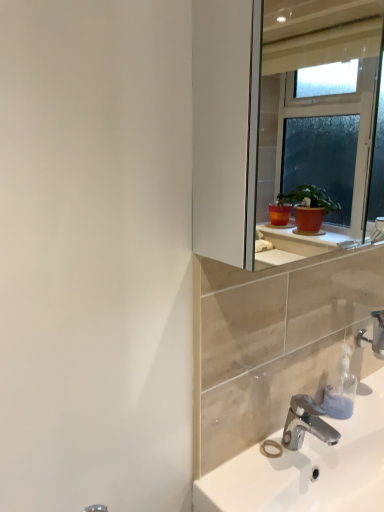
Question: Can you confirm if white glossy sink at lower right is positioned to the left of silver metallic faucet at lower right, which is the 1th tap in right-to-left order?

Choices:
 (A) no
 (B) yes

Answer: (B)

Question: Is white glossy sink at lower right shorter than silver metallic faucet at lower right, the 1th tap viewed from the top?

Choices:
 (A) yes
 (B) no

Answer: (A)

Question: Is white glossy sink at lower right further to camera compared to silver metallic faucet at lower right, placed as the second tap when sorted from bottom to top?

Choices:
 (A) yes
 (B) no

Answer: (B)

Question: Considering the relative sizes of white glossy sink at lower right and silver metallic faucet at lower right, the second tap in the left-to-right sequence, in the image provided, is white glossy sink at lower right wider than silver metallic faucet at lower right, the second tap in the left-to-right sequence,?

Choices:
 (A) yes
 (B) no

Answer: (A)

Question: Considering the relative positions of white glossy sink at lower right and silver metallic faucet at lower right, the 1th tap viewed from the top, in the image provided, is white glossy sink at lower right to the right of silver metallic faucet at lower right, the 1th tap viewed from the top, from the viewer's perspective?

Choices:
 (A) yes
 (B) no

Answer: (B)

Question: Is point (350, 373) positioned closer to the camera than point (299, 435)?

Choices:
 (A) closer
 (B) farther

Answer: (B)

Question: Is translucent plastic soap dispenser at lower right wider or thinner than chrome metallic faucet at lower right, which ranks as the second tap in right-to-left order?

Choices:
 (A) thin
 (B) wide

Answer: (A)

Question: Considering the relative positions of translucent plastic soap dispenser at lower right and chrome metallic faucet at lower right, placed as the second tap when sorted from back to front, in the image provided, is translucent plastic soap dispenser at lower right to the left or to the right of chrome metallic faucet at lower right, placed as the second tap when sorted from back to front,?

Choices:
 (A) left
 (B) right

Answer: (B)

Question: In the image, is translucent plastic soap dispenser at lower right positioned in front of or behind chrome metallic faucet at lower right, which ranks as the first tap in front-to-back order?

Choices:
 (A) front
 (B) behind

Answer: (B)

Question: In terms of height, does chrome metallic faucet at lower right, which appears as the second tap when viewed from the top, look taller or shorter compared to translucent plastic soap dispenser at lower right?

Choices:
 (A) tall
 (B) short

Answer: (B)

Question: From the image's perspective, is chrome metallic faucet at lower right, which ranks as the second tap in right-to-left order, above or below translucent plastic soap dispenser at lower right?

Choices:
 (A) below
 (B) above

Answer: (A)

Question: Considering the positions of point (299, 415) and point (340, 379), is point (299, 415) closer or farther from the camera than point (340, 379)?

Choices:
 (A) closer
 (B) farther

Answer: (A)

Question: Is chrome metallic faucet at lower right, which ranks as the second tap in right-to-left order, in front of or behind translucent plastic soap dispenser at lower right in the image?

Choices:
 (A) behind
 (B) front

Answer: (B)

Question: Is white glossy sink at lower right bigger or smaller than silver metallic faucet at lower right, the 1th tap viewed from the top?

Choices:
 (A) big
 (B) small

Answer: (A)

Question: Is white glossy sink at lower right taller or shorter than silver metallic faucet at lower right, the 1th tap positioned from the back?

Choices:
 (A) short
 (B) tall

Answer: (A)